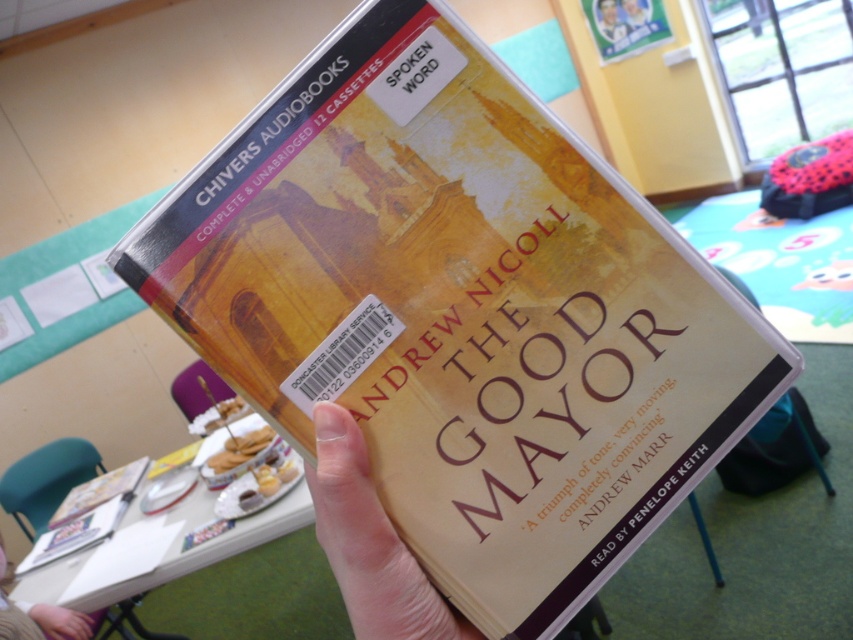
Is smooth skin hand at lower center behind hardcover book at center?

No, smooth skin hand at lower center is closer to the viewer.

Who is positioned more to the right, smooth skin hand at lower center or hardcover book at center?

smooth skin hand at lower center is more to the right.

The width and height of the screenshot is (853, 640). Identify the location of smooth skin hand at lower center. (39, 616).

Does smooth beige hand at center have a greater height compared to hardcover book at center?

In fact, smooth beige hand at center may be shorter than hardcover book at center.

The height and width of the screenshot is (640, 853). What do you see at coordinates (370, 544) in the screenshot?
I see `smooth beige hand at center` at bounding box center [370, 544].

Where is `smooth beige hand at center`? This screenshot has height=640, width=853. smooth beige hand at center is located at coordinates (370, 544).

Find the location of a particular element. smooth beige hand at center is located at coordinates (370, 544).

Which of these two, smooth beige hand at center or smooth skin hand at lower center, stands taller?

With more height is smooth skin hand at lower center.

Is point (448, 618) in front of point (90, 620)?

That is True.

I want to click on smooth beige hand at center, so click(370, 544).